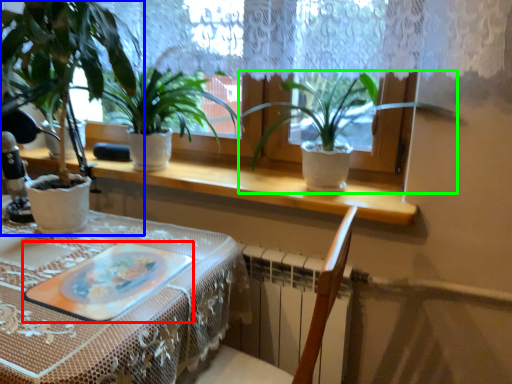
Question: Based on their relative distances, which object is nearer to platter (highlighted by a red box)? Choose from houseplant (highlighted by a blue box) and houseplant (highlighted by a green box).

Choices:
 (A) houseplant
 (B) houseplant

Answer: (A)